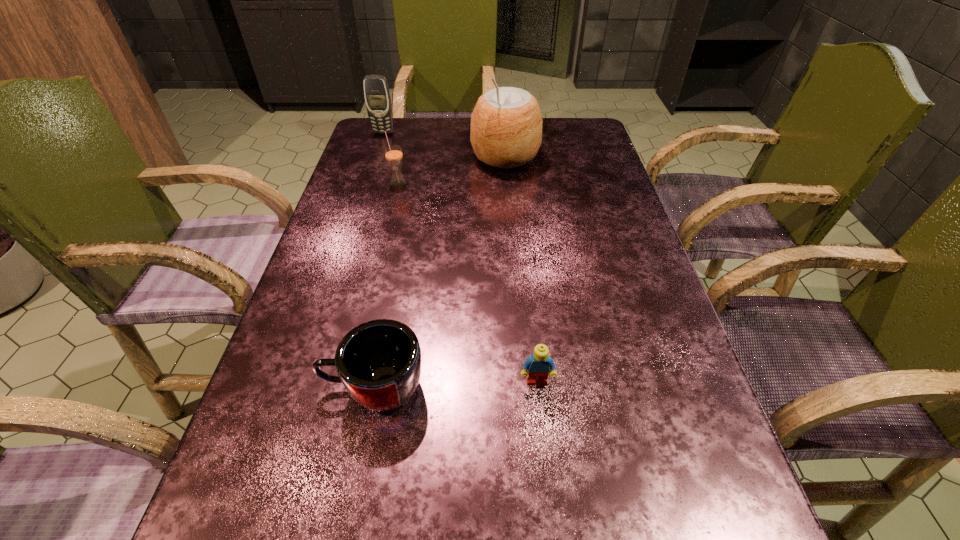
You are a GUI agent. You are given a task and a screenshot of the screen. Output one action in this format:
    pyautogui.click(x=<x>, y=<y>)
    Task: Click on the vacant space at the far right corner of the desktop
    The height and width of the screenshot is (540, 960).
    Given the screenshot: What is the action you would take?
    pyautogui.click(x=560, y=137)

At what (x,y) coordinates should I click in order to perform the action: click on blank region between the third shortest object and the Lego. Please return your answer as a coordinate pair (x, y). The width and height of the screenshot is (960, 540). Looking at the image, I should click on (468, 282).

Identify the location of empty space between the tallest object and the second tallest object. This screenshot has width=960, height=540. (444, 145).

Where is `free space between the mug and the cellular telephone`? free space between the mug and the cellular telephone is located at coordinates (378, 260).

The height and width of the screenshot is (540, 960). In order to click on empty space that is in between the third farthest object and the mug in this screenshot , I will do click(386, 285).

Locate an element on the screen. vacant space that's between the mug and the Lego is located at coordinates (455, 384).

The image size is (960, 540). I want to click on vacant point located between the mug and the farthest object, so click(x=378, y=260).

Where is `free space between the straw and the mug`? free space between the straw and the mug is located at coordinates click(386, 285).

You are a GUI agent. You are given a task and a screenshot of the screen. Output one action in this format:
    pyautogui.click(x=<x>, y=<y>)
    Task: Click on the object that is the second closest one to the Lego
    The height and width of the screenshot is (540, 960).
    Given the screenshot: What is the action you would take?
    pyautogui.click(x=393, y=153)

Find the location of a particular element. The width and height of the screenshot is (960, 540). object that is the second closest to the cellular telephone is located at coordinates (393, 153).